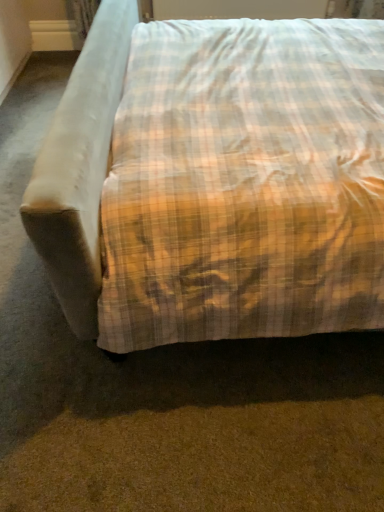
Image resolution: width=384 pixels, height=512 pixels. What do you see at coordinates (179, 228) in the screenshot?
I see `plaid fabric bed at center` at bounding box center [179, 228].

Identify the location of plaid fabric bed at center. (179, 228).

You are a GUI agent. You are given a task and a screenshot of the screen. Output one action in this format:
    pyautogui.click(x=<x>, y=<y>)
    Task: Click on the plaid fabric bed at center
    This screenshot has width=384, height=512.
    Given the screenshot: What is the action you would take?
    pyautogui.click(x=179, y=228)